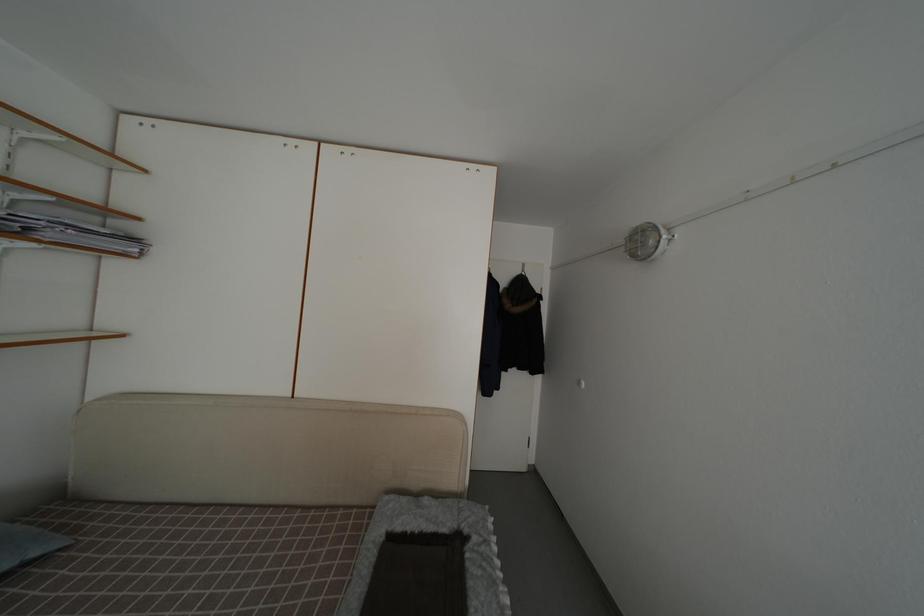
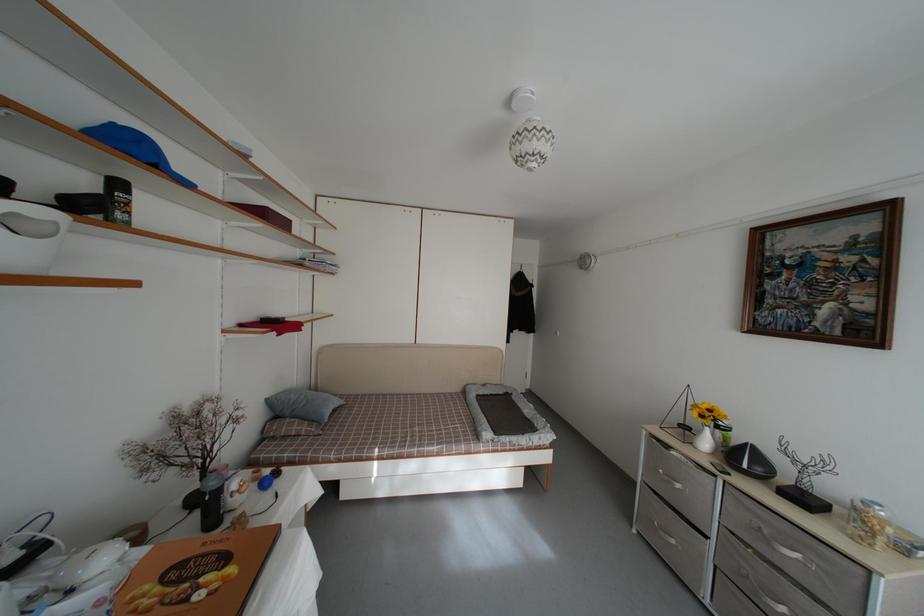
The point at (x=465, y=545) is marked in the first image. Where is the corresponding point in the second image?

(513, 402)